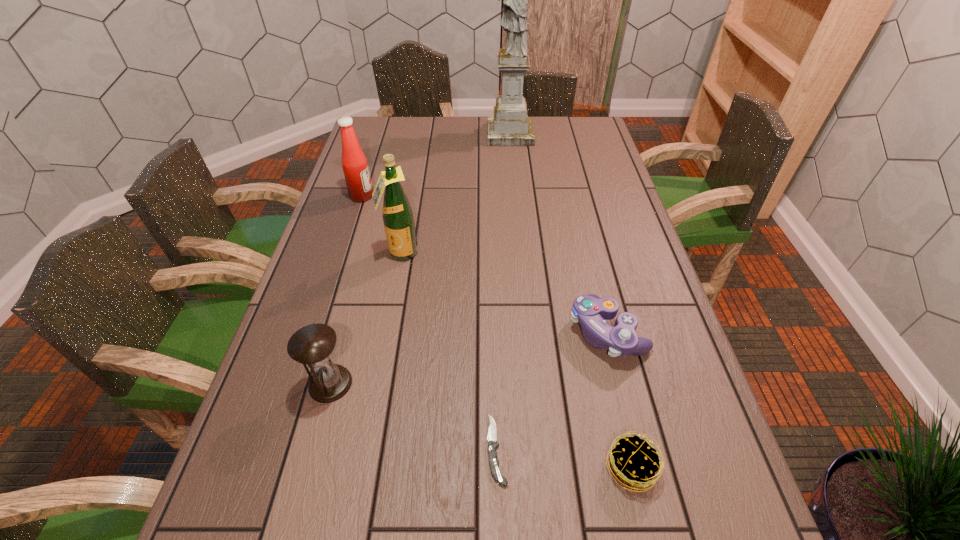
I want to click on condiment that is at the left edge, so click(354, 163).

Where is `hourglass that is at the left edge`? The height and width of the screenshot is (540, 960). hourglass that is at the left edge is located at coordinates (313, 344).

Identify the location of control located in the right edge section of the desktop. Image resolution: width=960 pixels, height=540 pixels. (589, 311).

I want to click on patty that is at the right edge, so click(x=633, y=461).

Identify the location of free point at the far edge. The height and width of the screenshot is (540, 960). (437, 146).

In order to click on vacant space at the left edge in this screenshot , I will do `click(342, 268)`.

The image size is (960, 540). I want to click on free location at the right edge of the desktop, so tap(564, 154).

The height and width of the screenshot is (540, 960). What are the coordinates of `vacant space at the far right corner of the desktop` in the screenshot? It's located at [x=580, y=145].

Identify the location of vacant region between the hourglass and the sixth nearest object. This screenshot has height=540, width=960. (347, 290).

You are a GUI agent. You are given a task and a screenshot of the screen. Output one action in this format:
    pyautogui.click(x=<x>, y=<y>)
    Task: Click on the unoccupied area between the control and the sixth nearest object
    
    Given the screenshot: What is the action you would take?
    [485, 264]